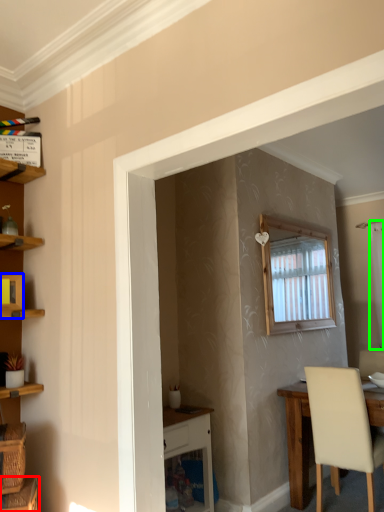
Question: Which object is the closest to the basket (highlighted by a red box)? Choose among these: cabinet (highlighted by a blue box) or curtain (highlighted by a green box).

Choices:
 (A) cabinet
 (B) curtain

Answer: (A)